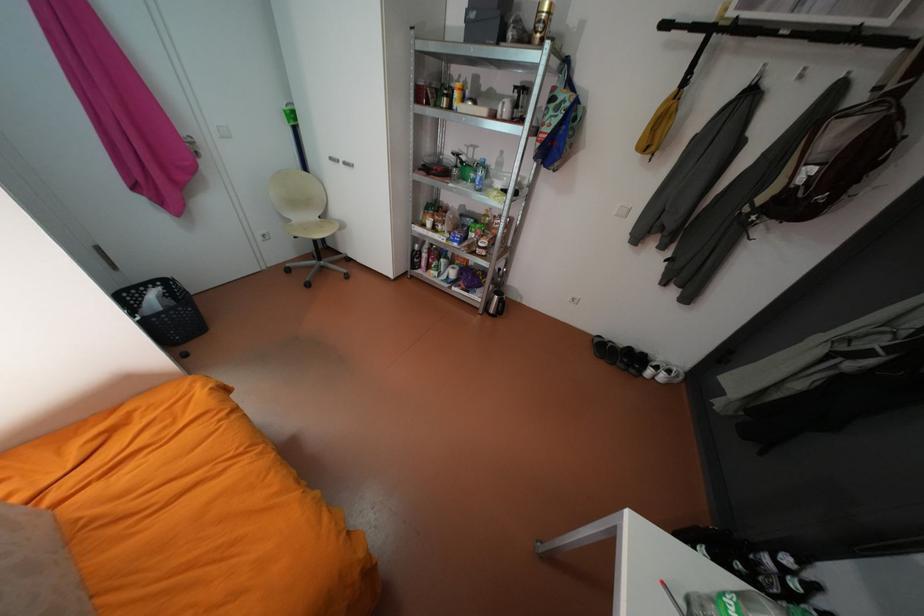
You are a GUI agent. You are given a task and a screenshot of the screen. Output one action in this format:
    pyautogui.click(x=<x>, y=<y>)
    Task: Click on the red and silver pen
    The image size is (924, 616).
    Given the screenshot: What is the action you would take?
    pyautogui.click(x=671, y=598)